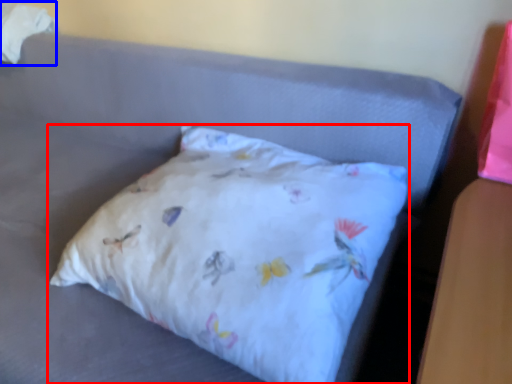
Question: Which of the following is the farthest to the observer, pillow (highlighted by a red box) or material (highlighted by a blue box)?

Choices:
 (A) pillow
 (B) material

Answer: (B)